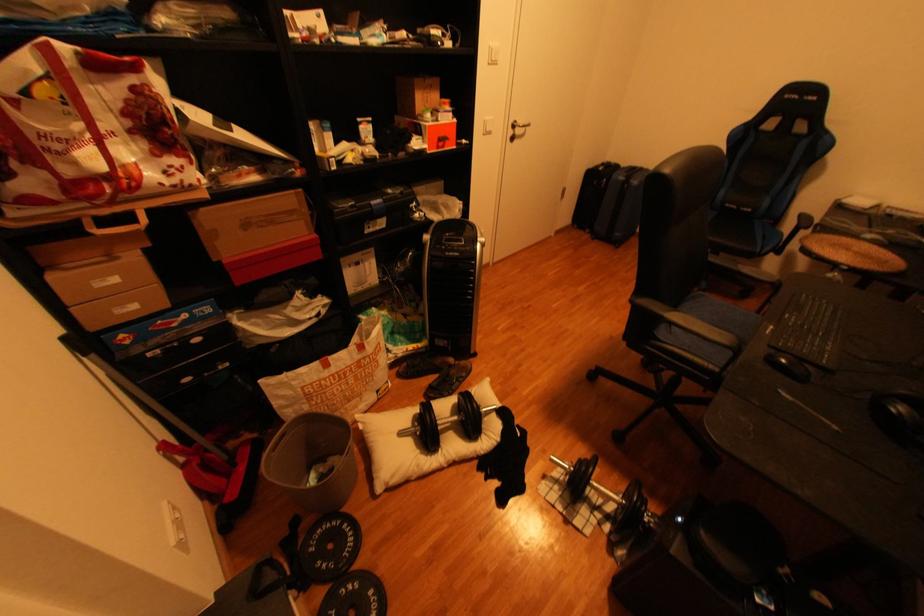
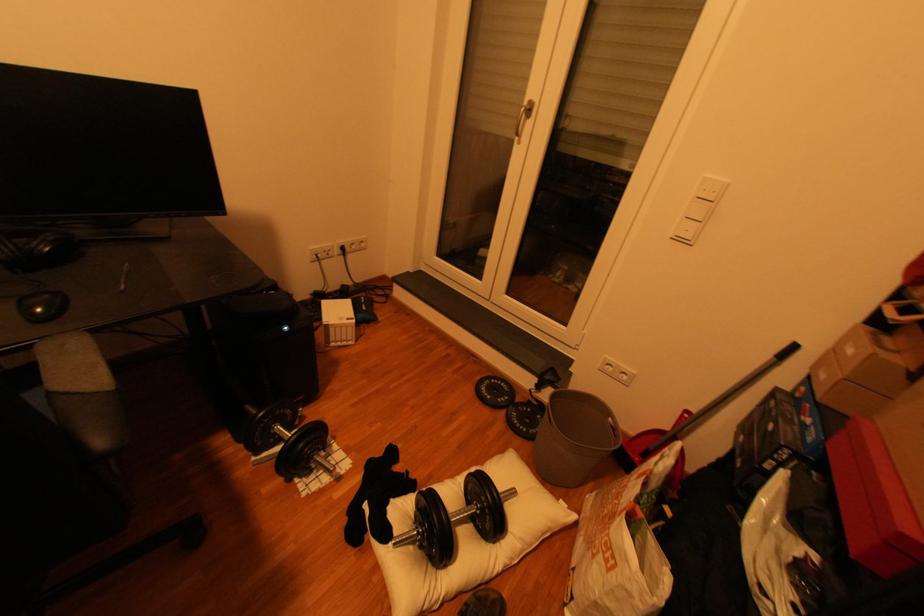
Locate, in the second image, the point that corresponds to point 343,525 in the first image.

(543, 431)